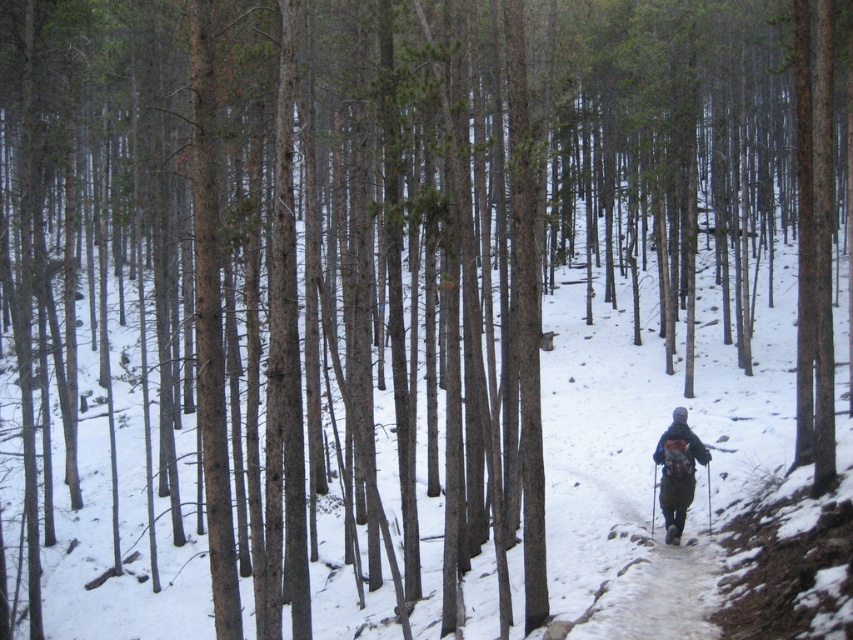
Question: Does snowy dirt path at center appear on the left side of dark gray backpack at center?

Choices:
 (A) no
 (B) yes

Answer: (B)

Question: Which point is closer to the camera?

Choices:
 (A) (680, 451)
 (B) (701, 540)

Answer: (A)

Question: In this image, where is snowy dirt path at center located relative to dark gray backpack at center?

Choices:
 (A) right
 (B) left

Answer: (B)

Question: Which of the following is the farthest from the observer?

Choices:
 (A) snowy dirt path at center
 (B) dark gray backpack at center

Answer: (B)

Question: Is snowy dirt path at center to the left of dark gray backpack at center from the viewer's perspective?

Choices:
 (A) yes
 (B) no

Answer: (A)